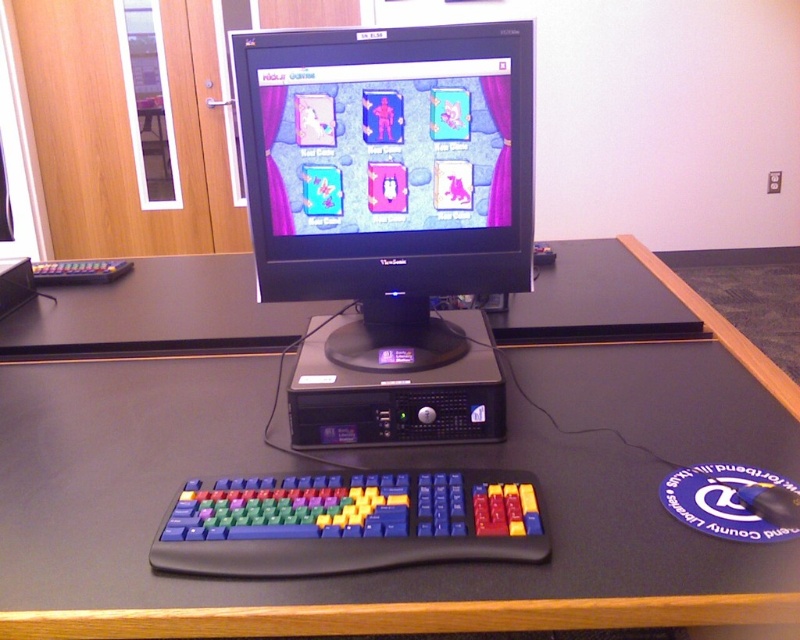
Question: Does black plastic computer tower at center come behind black matte mouse at lower right?

Choices:
 (A) yes
 (B) no

Answer: (A)

Question: Which object is the closest to the black plastic desktop computer at center?

Choices:
 (A) multicolored plastic keyboard at lower center
 (B) black plastic computer tower at center
 (C) black matte table at center
 (D) black matte mouse at lower right

Answer: (B)

Question: Is black matte table at center positioned at the back of black plastic computer tower at center?

Choices:
 (A) no
 (B) yes

Answer: (A)

Question: Which point is closer to the camera?

Choices:
 (A) multicolored plastic keyboard at lower center
 (B) black plastic computer tower at center

Answer: (A)

Question: Which point appears closest to the camera in this image?

Choices:
 (A) (413, 424)
 (B) (36, 618)
 (C) (762, 502)
 (D) (464, 440)

Answer: (B)

Question: Does black matte table at center appear on the left side of multicolored plastic keyboard at lower center?

Choices:
 (A) no
 (B) yes

Answer: (B)